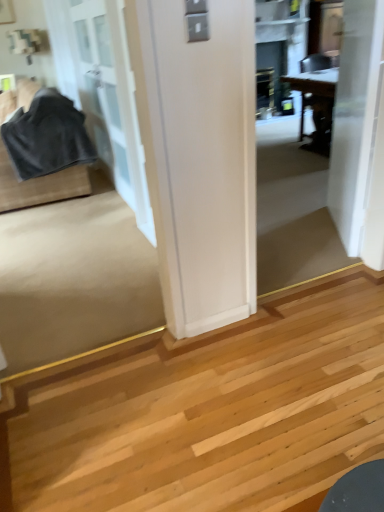
At what (x,y) coordinates should I click in order to perform the action: click on free region on the left part of white smooth door at upper right, which ranks as the second door in left-to-right order. Please return your answer as a coordinate pair (x, y). The height and width of the screenshot is (512, 384). Looking at the image, I should click on (294, 241).